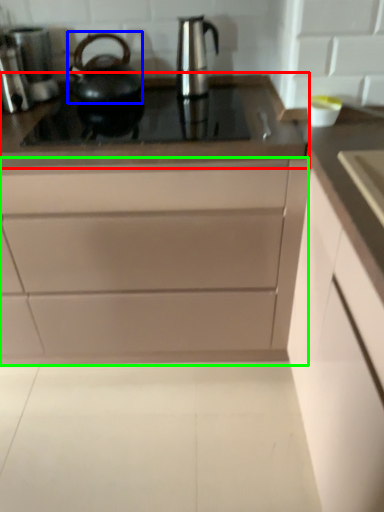
Question: Which object is the closest to the countertop (highlighted by a red box)? Choose among these: kettle (highlighted by a blue box) or cabinetry (highlighted by a green box).

Choices:
 (A) kettle
 (B) cabinetry

Answer: (A)